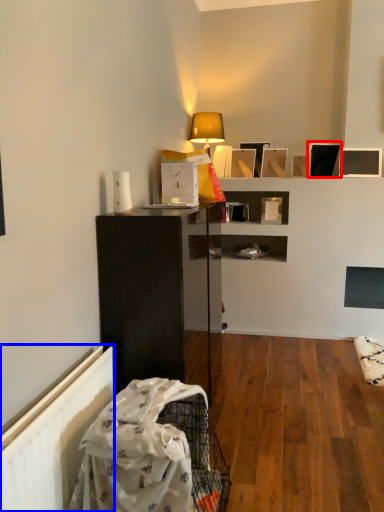
Question: Which object appears farthest to the camera in this image, picture frame (highlighted by a red box) or radiator (highlighted by a blue box)?

Choices:
 (A) picture frame
 (B) radiator

Answer: (A)